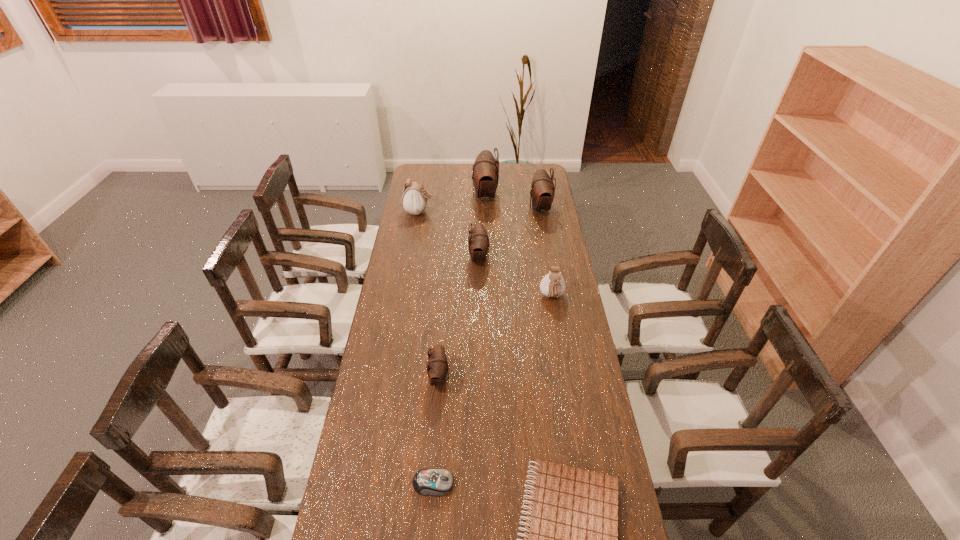
At what (x,y) coordinates should I click in order to perform the action: click on the tallest pouch. Please return your answer as a coordinate pair (x, y). The height and width of the screenshot is (540, 960). Looking at the image, I should click on click(x=485, y=175).

The height and width of the screenshot is (540, 960). Find the location of `the biggest brown pouch`. the biggest brown pouch is located at coordinates (485, 175).

The image size is (960, 540). I want to click on the rightmost brown pouch, so 542,191.

Identify the location of the left white pouch. (414, 200).

Where is `the farther white pouch`? The width and height of the screenshot is (960, 540). the farther white pouch is located at coordinates 414,200.

Where is `the fourth farthest pouch`? the fourth farthest pouch is located at coordinates (478, 241).

At what (x,y) coordinates should I click in order to perform the action: click on the second smallest brown pouch. Please return your answer as a coordinate pair (x, y). Image resolution: width=960 pixels, height=540 pixels. Looking at the image, I should click on (478, 241).

At what (x,y) coordinates should I click in order to perform the action: click on the right white pouch. Please return your answer as a coordinate pair (x, y). Looking at the image, I should click on point(552,285).

Locate an element on the screen. The image size is (960, 540). the fourth nearest object is located at coordinates (552, 285).

In order to click on the nearest brown pouch in this screenshot , I will do `click(437, 364)`.